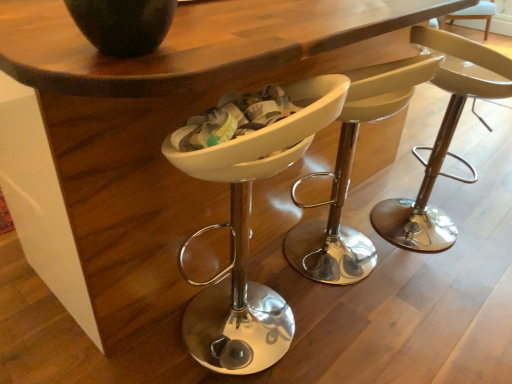
Locate an element on the screen. free space to the left of matte black vase at upper left is located at coordinates (52, 31).